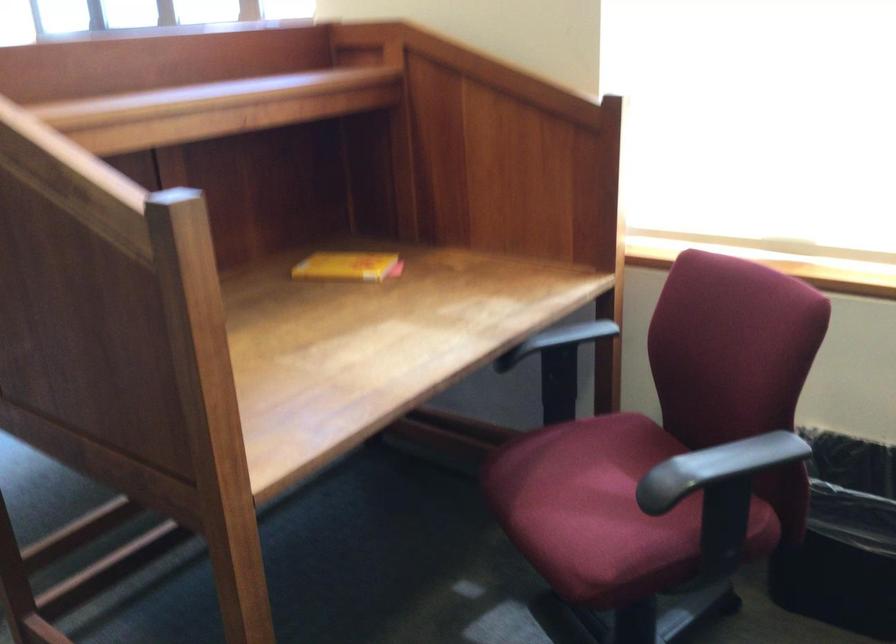
This screenshot has height=644, width=896. I want to click on chair sitting surface, so click(x=592, y=509).